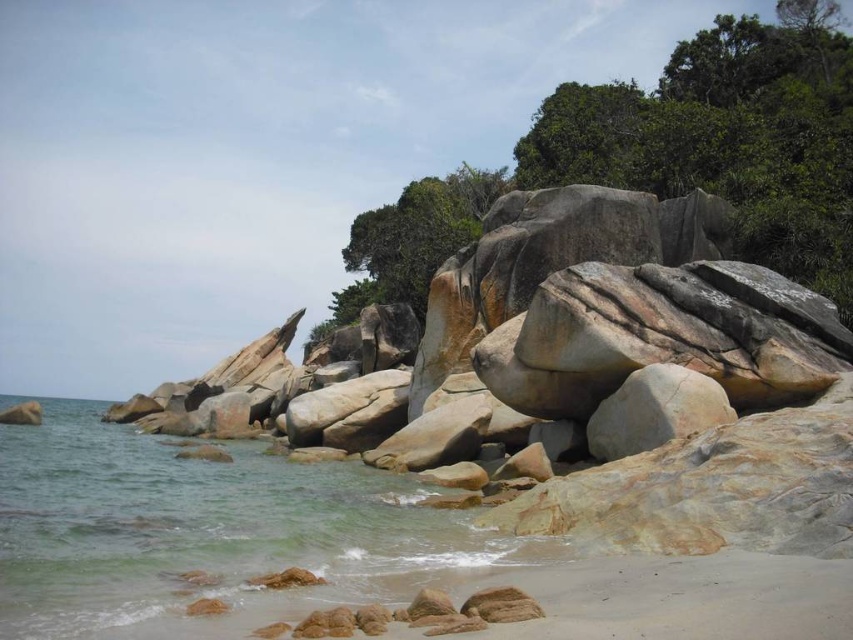
Question: Can you confirm if green leafy tree at upper center is positioned above green textured tree at upper center?

Choices:
 (A) yes
 (B) no

Answer: (A)

Question: Which point is farther to the camera?

Choices:
 (A) green textured tree at upper center
 (B) green leafy tree at upper center
 (C) rustic stone boulders at center
 (D) clear water at lower left

Answer: (A)

Question: Among these objects, which one is nearest to the camera?

Choices:
 (A) rustic stone boulders at center
 (B) clear water at lower left
 (C) green leafy tree at upper center

Answer: (B)

Question: Which object appears farthest from the camera in this image?

Choices:
 (A) green textured tree at upper center
 (B) clear water at lower left
 (C) rustic stone boulders at center
 (D) green leafy tree at upper center

Answer: (A)

Question: Does rustic stone boulders at center appear over green leafy tree at upper center?

Choices:
 (A) yes
 (B) no

Answer: (B)

Question: Is rustic stone boulders at center closer to the viewer compared to green leafy tree at upper center?

Choices:
 (A) no
 (B) yes

Answer: (B)